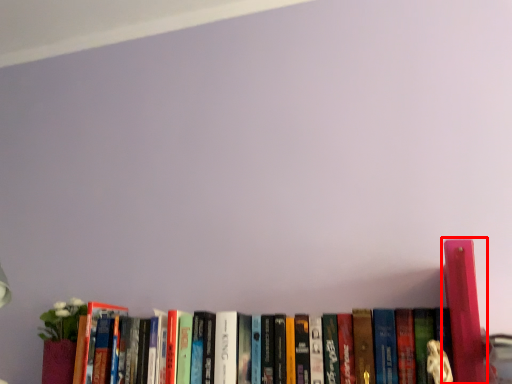
Question: In this image, where is book (annotated by the red box) located relative to book?

Choices:
 (A) right
 (B) left

Answer: (A)